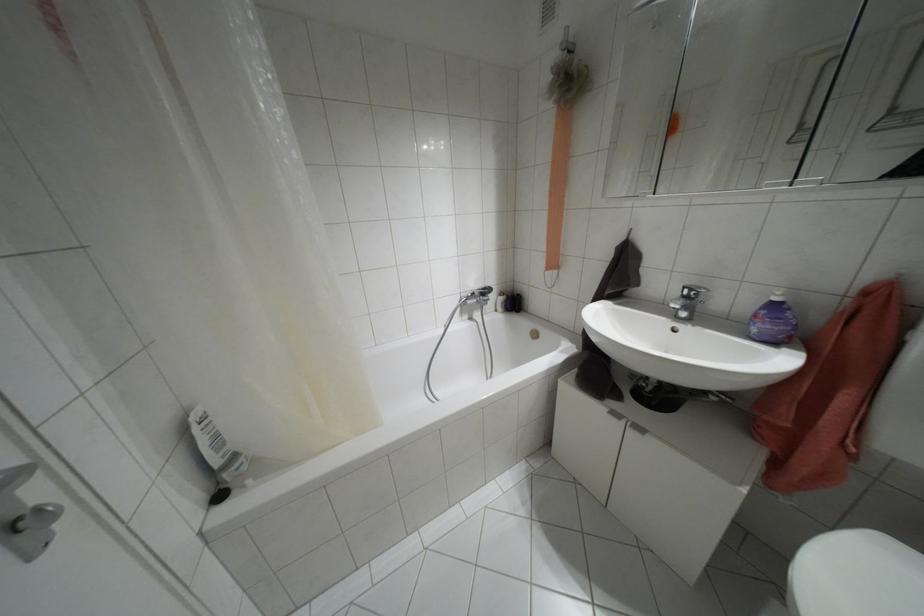
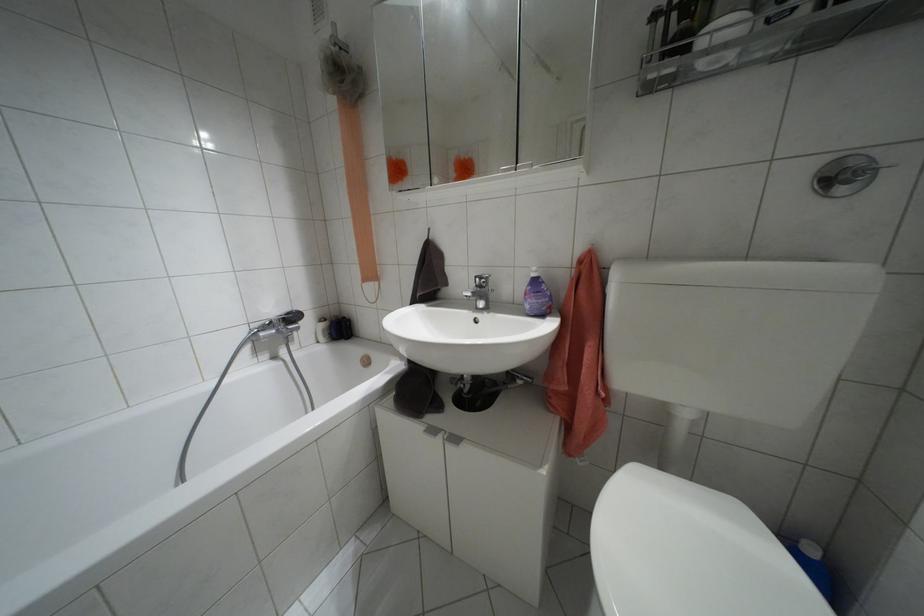
Locate, in the second image, the point that corresponds to (686,297) in the first image.

(479, 286)